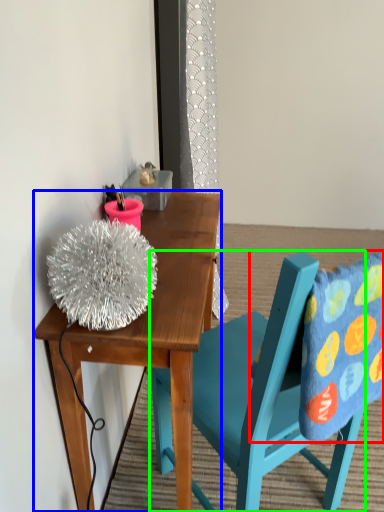
Question: Based on their relative distances, which object is nearer to pillow (highlighted by a red box)? Choose from desk (highlighted by a blue box) and chair (highlighted by a green box).

Choices:
 (A) desk
 (B) chair

Answer: (B)